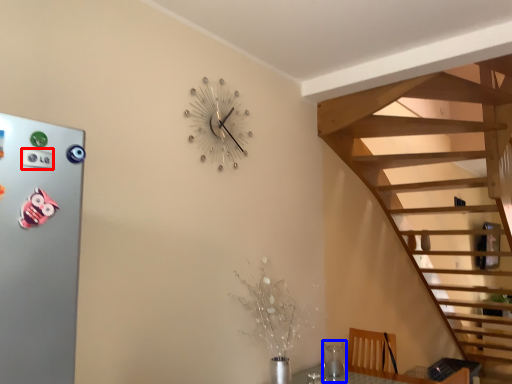
Question: Which of the following is the closest to the observer, button (highlighted by a red box) or glass vase (highlighted by a blue box)?

Choices:
 (A) button
 (B) glass vase

Answer: (A)